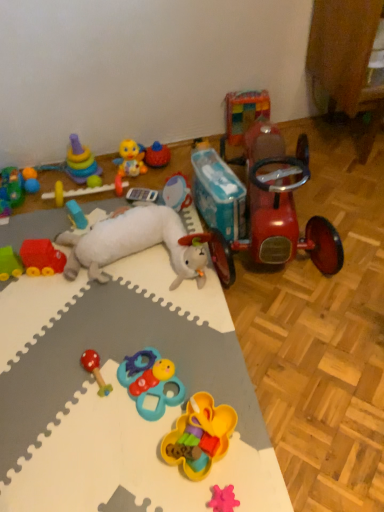
Where is `free space between pink rubber bear at lower center, which is the 11th toy in left-to-right order, and white plush toy at center, the seventh toy when ordered from left to right`? Image resolution: width=384 pixels, height=512 pixels. free space between pink rubber bear at lower center, which is the 11th toy in left-to-right order, and white plush toy at center, the seventh toy when ordered from left to right is located at coordinates (157, 334).